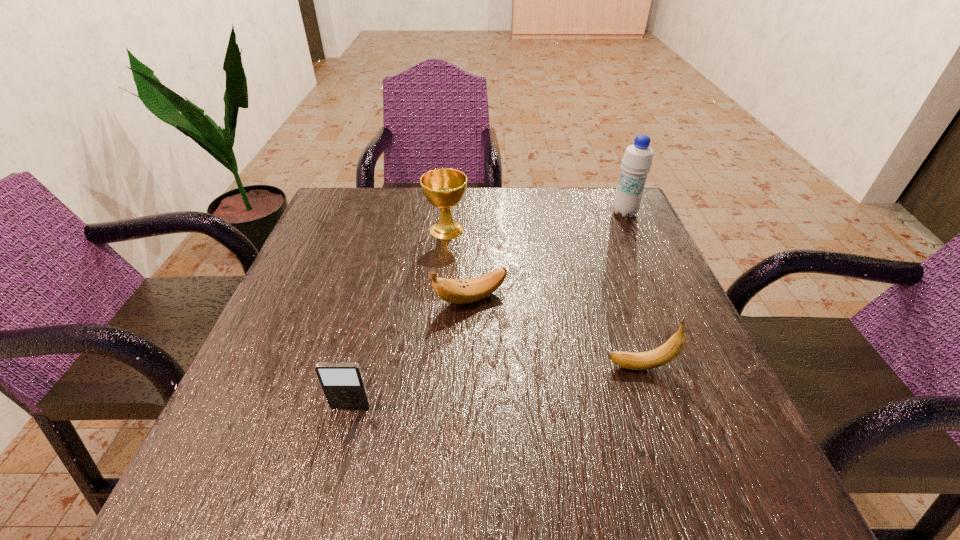
Image resolution: width=960 pixels, height=540 pixels. Find the location of `water bottle`. water bottle is located at coordinates (637, 161).

At what (x,y) coordinates should I click in order to perform the action: click on chalice. Please return your answer as a coordinate pair (x, y). The width and height of the screenshot is (960, 540). Looking at the image, I should click on (444, 188).

Where is `the second nearest object`? The height and width of the screenshot is (540, 960). the second nearest object is located at coordinates (664, 354).

Where is `the taller banana`? This screenshot has width=960, height=540. the taller banana is located at coordinates (x=664, y=354).

Locate an element on the screen. the leftmost object is located at coordinates (343, 385).

Where is `iPod`? Image resolution: width=960 pixels, height=540 pixels. iPod is located at coordinates (343, 385).

Where is `the third nearest object`? The image size is (960, 540). the third nearest object is located at coordinates (461, 291).

This screenshot has width=960, height=540. In order to click on the farther banana in this screenshot , I will do `click(461, 291)`.

Locate an element on the screen. The width and height of the screenshot is (960, 540). free space located 0.220m on the front of the water bottle is located at coordinates (654, 278).

Where is `free point located 0.170m on the left of the chalice`? The image size is (960, 540). free point located 0.170m on the left of the chalice is located at coordinates (355, 230).